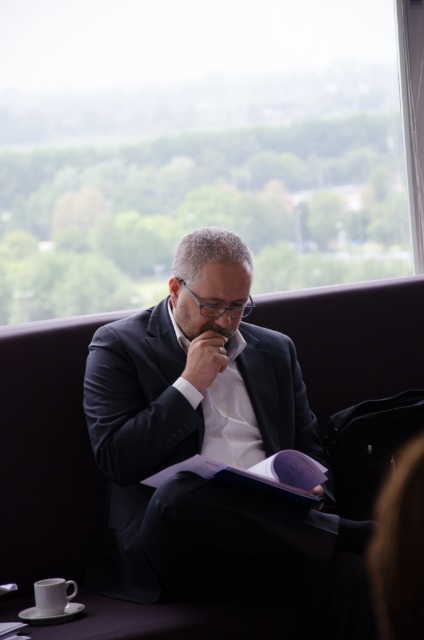
Question: Does white ceramic mug at lower left have a lesser width compared to matte skin at center?

Choices:
 (A) no
 (B) yes

Answer: (B)

Question: Which object appears closest to the camera in this image?

Choices:
 (A) dark suit at center
 (B) matte skin at center

Answer: (A)

Question: Is the position of dark suit at center more distant than that of matte skin at center?

Choices:
 (A) no
 (B) yes

Answer: (A)

Question: Where is dark suit at center located in relation to matte skin at center in the image?

Choices:
 (A) right
 (B) left

Answer: (B)

Question: Which point appears farthest from the camera in this image?

Choices:
 (A) (55, 580)
 (B) (279, 403)
 (C) (195, 333)

Answer: (B)

Question: Which object is farther from the camera taking this photo?

Choices:
 (A) dark suit at center
 (B) matte skin at center
 (C) white ceramic mug at lower left

Answer: (B)